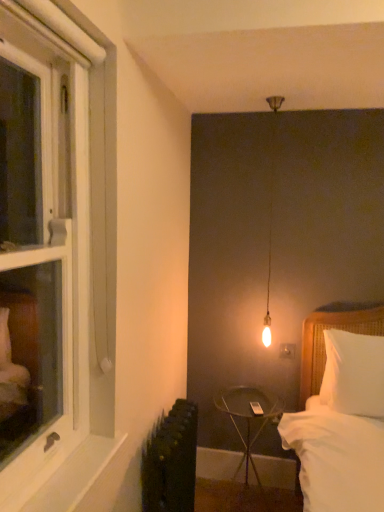
Question: Considering the positions of matte white outlet at center-right and white painted wood at lower left in the image, is matte white outlet at center-right taller or shorter than white painted wood at lower left?

Choices:
 (A) short
 (B) tall

Answer: (B)

Question: Visually, is matte white outlet at center-right positioned to the left or to the right of white painted wood at lower left?

Choices:
 (A) right
 (B) left

Answer: (A)

Question: Estimate the real-world distances between objects in this image. Which object is closer to the white wood window at left?

Choices:
 (A) white soft pillow at right
 (B) matte white outlet at center-right
 (C) metallic black side table at center
 (D) white painted wood at lower left

Answer: (D)

Question: Based on their relative distances, which object is nearer to the white wood window at left?

Choices:
 (A) matte white outlet at center-right
 (B) white painted wood at lower left
 (C) white soft pillow at right
 (D) metallic black side table at center

Answer: (B)